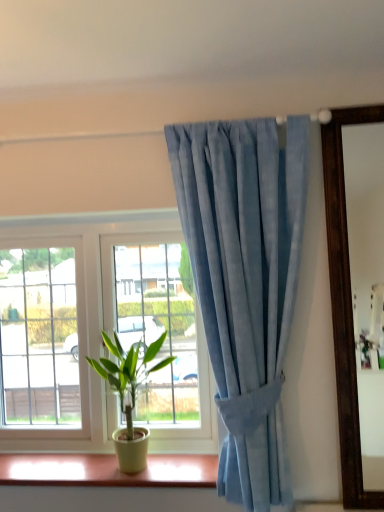
This screenshot has height=512, width=384. In order to click on free spot to the left of green matte plant at lower left in this screenshot , I will do `click(48, 464)`.